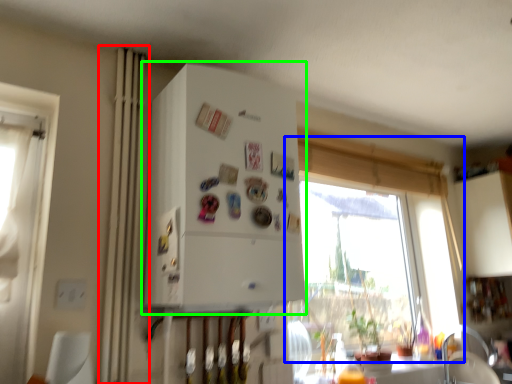
Question: Which is nearer to the curtain (highlighted by a red box)? window (highlighted by a blue box) or appliance (highlighted by a green box).

Choices:
 (A) window
 (B) appliance

Answer: (B)